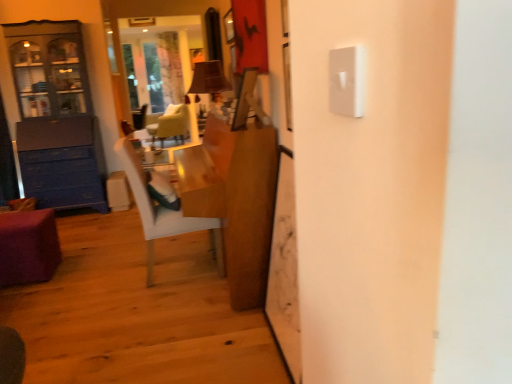
Image resolution: width=512 pixels, height=384 pixels. In order to click on vacant space situated on the left part of white glossy chair at center, acting as the 2th chair starting from the back in this screenshot , I will do `click(100, 275)`.